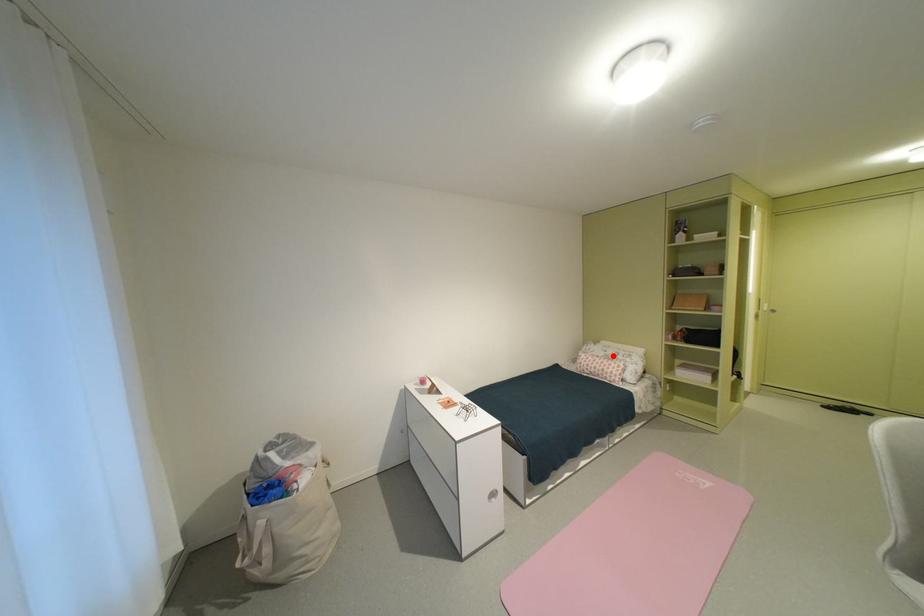
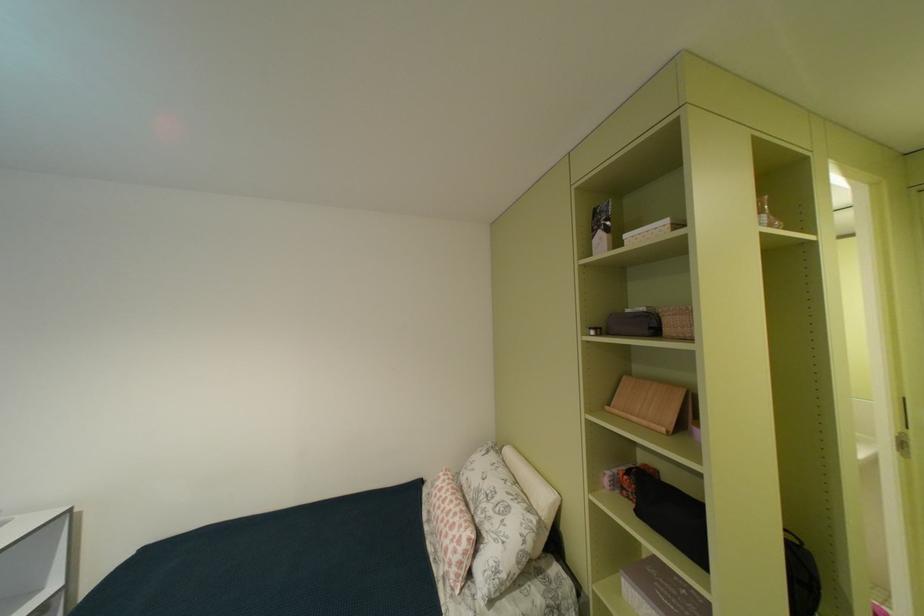
The point at the highlighted location is marked in the first image. Where is the corresponding point in the second image?

(487, 487)